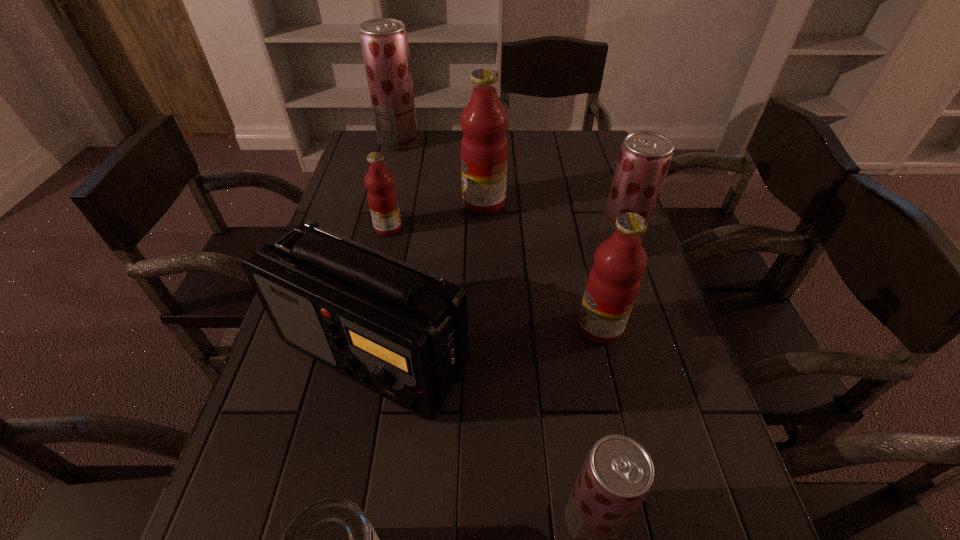
The height and width of the screenshot is (540, 960). I want to click on the farthest object, so click(384, 42).

This screenshot has width=960, height=540. In order to click on the leftmost strawberry fruit juice in this screenshot , I will do `click(384, 42)`.

Locate an element on the screen. the farthest pink fruit juice is located at coordinates (484, 121).

Image resolution: width=960 pixels, height=540 pixels. Identify the location of the biggest pink fruit juice. (484, 121).

The width and height of the screenshot is (960, 540). I want to click on the rightmost strawberry fruit juice, so click(645, 156).

Locate an element on the screen. The height and width of the screenshot is (540, 960). the second farthest strawberry fruit juice is located at coordinates (645, 156).

Locate an element on the screen. The width and height of the screenshot is (960, 540). the rightmost pink fruit juice is located at coordinates (613, 283).

Where is `the fifth farthest fruit juice`? the fifth farthest fruit juice is located at coordinates (613, 283).

Where is `radio receiver`? radio receiver is located at coordinates (400, 331).

Locate an element on the screen. This screenshot has width=960, height=540. the leftmost pink fruit juice is located at coordinates (382, 197).